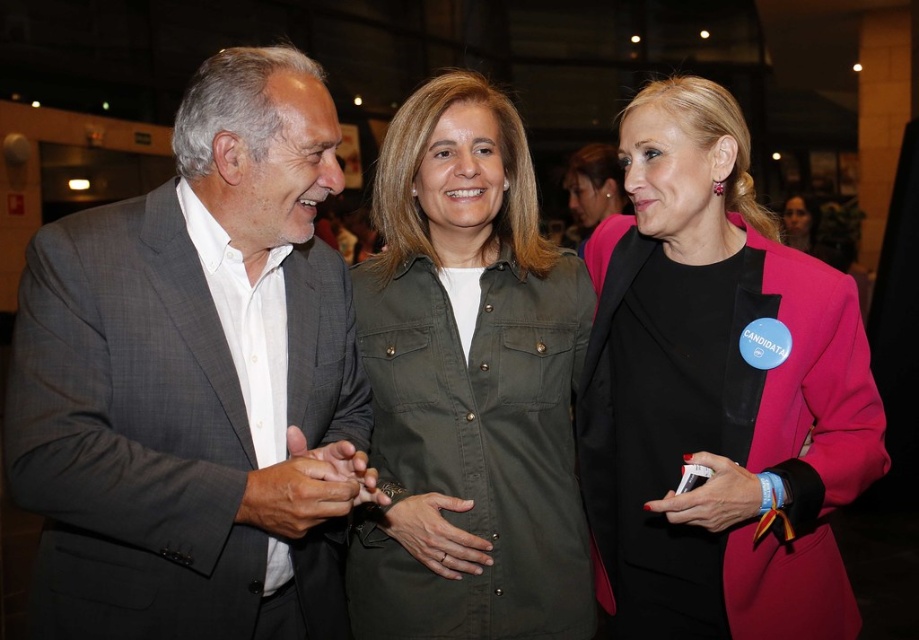
Between pink matte blazer at center and green matte shirt at center, which one appears on the left side from the viewer's perspective?

green matte shirt at center

Does pink matte blazer at center lie in front of green matte shirt at center?

Yes, pink matte blazer at center is closer to the viewer.

Which is behind, point (590, 433) or point (489, 353)?

Point (590, 433)

Identify the location of pink matte blazer at center. The width and height of the screenshot is (919, 640). (716, 394).

Which is below, gray suit at left or green matte shirt at center?

green matte shirt at center

Is gray suit at left bigger than green matte shirt at center?

Incorrect, gray suit at left is not larger than green matte shirt at center.

Which is behind, point (70, 429) or point (532, 301)?

The point (532, 301) is behind.

Where is `gray suit at left`? The width and height of the screenshot is (919, 640). gray suit at left is located at coordinates (196, 381).

Who is shorter, gray suit at left or pink matte blazer at center?

gray suit at left

Which is in front, point (241, 563) or point (762, 636)?

Point (241, 563) is more forward.

What do you see at coordinates (196, 381) in the screenshot? I see `gray suit at left` at bounding box center [196, 381].

Where is `gray suit at left`? gray suit at left is located at coordinates (196, 381).